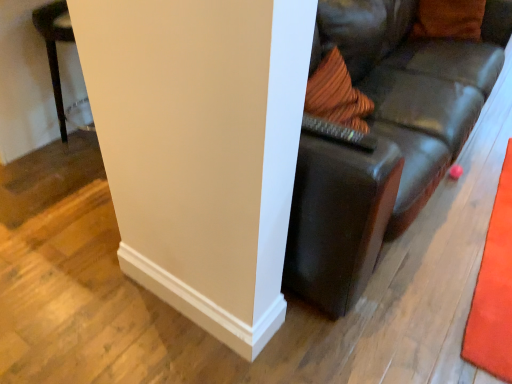
Question: From the image's perspective, is orange carpet at right on top of white smooth wall at center?

Choices:
 (A) no
 (B) yes

Answer: (B)

Question: Is orange carpet at right outside of white smooth wall at center?

Choices:
 (A) yes
 (B) no

Answer: (A)

Question: Is orange carpet at right to the right of white smooth wall at center from the viewer's perspective?

Choices:
 (A) no
 (B) yes

Answer: (B)

Question: Can you confirm if orange carpet at right is shorter than white smooth wall at center?

Choices:
 (A) yes
 (B) no

Answer: (A)

Question: Is orange carpet at right looking in the opposite direction of white smooth wall at center?

Choices:
 (A) yes
 (B) no

Answer: (B)

Question: From the image's perspective, is orange carpet at right located beneath white smooth wall at center?

Choices:
 (A) yes
 (B) no

Answer: (B)

Question: Is orange carpet at right completely or partially outside of orange fabric pillow at upper right?

Choices:
 (A) yes
 (B) no

Answer: (A)

Question: Considering the relative positions of orange carpet at right and orange fabric pillow at upper right in the image provided, is orange carpet at right to the right of orange fabric pillow at upper right from the viewer's perspective?

Choices:
 (A) no
 (B) yes

Answer: (B)

Question: Is orange carpet at right positioned with its back to orange fabric pillow at upper right?

Choices:
 (A) yes
 (B) no

Answer: (B)

Question: Is orange fabric pillow at upper right inside orange carpet at right?

Choices:
 (A) no
 (B) yes

Answer: (A)

Question: Is orange carpet at right with orange fabric pillow at upper right?

Choices:
 (A) no
 (B) yes

Answer: (A)

Question: Is orange carpet at right bigger than orange fabric pillow at upper right?

Choices:
 (A) no
 (B) yes

Answer: (A)

Question: Is leather couch at center surrounded by orange carpet at right?

Choices:
 (A) no
 (B) yes

Answer: (A)